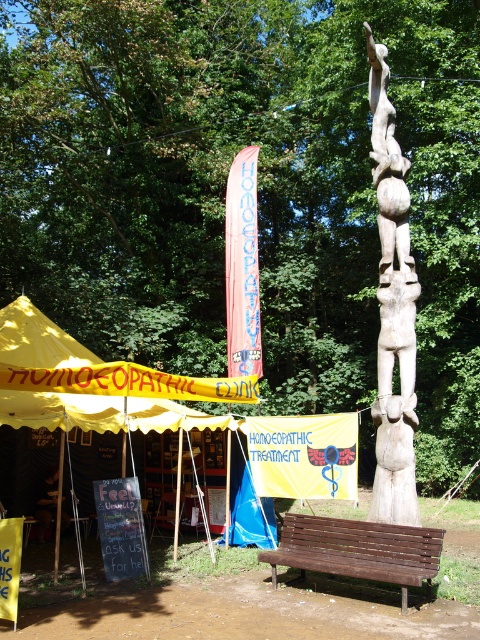
Can you confirm if brown wooden bench at lower center is positioned to the left of yellow fabric banner at center?

No, brown wooden bench at lower center is not to the left of yellow fabric banner at center.

Does point (421, 531) lie behind point (264, 496)?

No, it is in front of (264, 496).

I want to click on brown wooden bench at lower center, so click(x=358, y=550).

Does yellow fabric tent at lower left have a lesser width compared to wooden statue at center?

No, yellow fabric tent at lower left is not thinner than wooden statue at center.

Who is more distant from viewer, (24, 349) or (380, 88)?

The point (24, 349) is behind.

Describe the element at coordinates (96, 384) in the screenshot. I see `yellow fabric tent at lower left` at that location.

In order to click on yellow fabric tent at lower left in this screenshot , I will do `click(96, 384)`.

Where is `yellow fabric tent at lower left`? This screenshot has height=640, width=480. yellow fabric tent at lower left is located at coordinates (96, 384).

Between yellow fabric tent at lower left and yellow fabric banner at center, which one appears on the right side from the viewer's perspective?

Positioned to the right is yellow fabric banner at center.

Which is behind, point (255, 394) or point (255, 484)?

The point (255, 394) is behind.

Find the location of a particular element. This screenshot has width=480, height=640. yellow fabric tent at lower left is located at coordinates (96, 384).